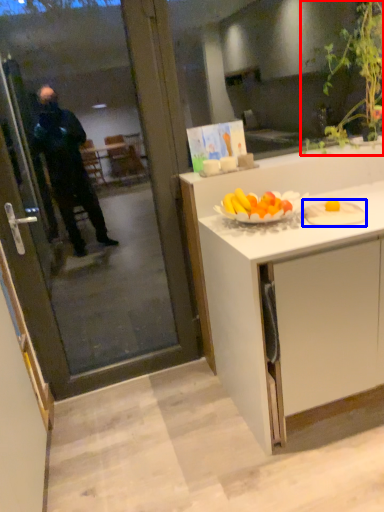
Question: Which object appears closest to the camera in this image, houseplant (highlighted by a red box) or plate (highlighted by a blue box)?

Choices:
 (A) houseplant
 (B) plate

Answer: (B)